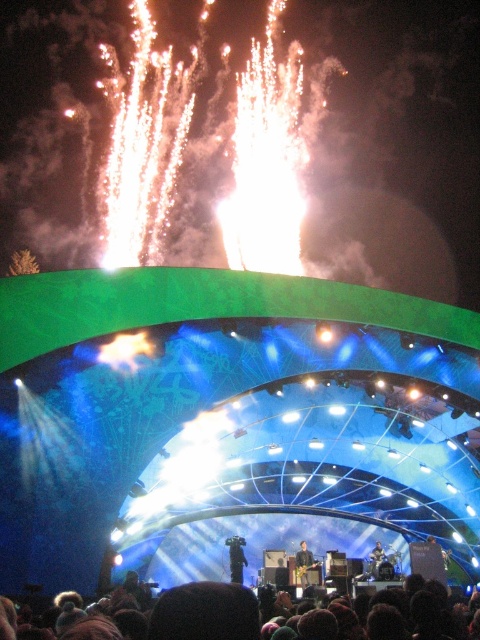
Who is taller, brown hair at lower center or metallic silver guitar at center?

With more height is brown hair at lower center.

Is brown hair at lower center shorter than metallic silver guitar at center?

Incorrect, brown hair at lower center's height does not fall short of metallic silver guitar at center's.

Identify the location of brown hair at lower center. The image size is (480, 640). (204, 612).

Between point (255, 598) and point (231, 570), which one is positioned in front?

Positioned in front is point (255, 598).

Which of these two, brown hair at lower center or dark blue fabric at center, stands shorter?

dark blue fabric at center

Is point (245, 605) positioned behind point (232, 563)?

No, (245, 605) is closer to viewer.

Find the location of `brown hair at lower center`. brown hair at lower center is located at coordinates (204, 612).

Does brown hair at lower center have a lesser width compared to smooth skin person at center?

No, brown hair at lower center is not thinner than smooth skin person at center.

Can you confirm if brown hair at lower center is positioned to the right of smooth skin person at center?

Incorrect, brown hair at lower center is not on the right side of smooth skin person at center.

I want to click on brown hair at lower center, so click(x=204, y=612).

Locate an element on the screen. This screenshot has height=640, width=480. brown hair at lower center is located at coordinates (204, 612).